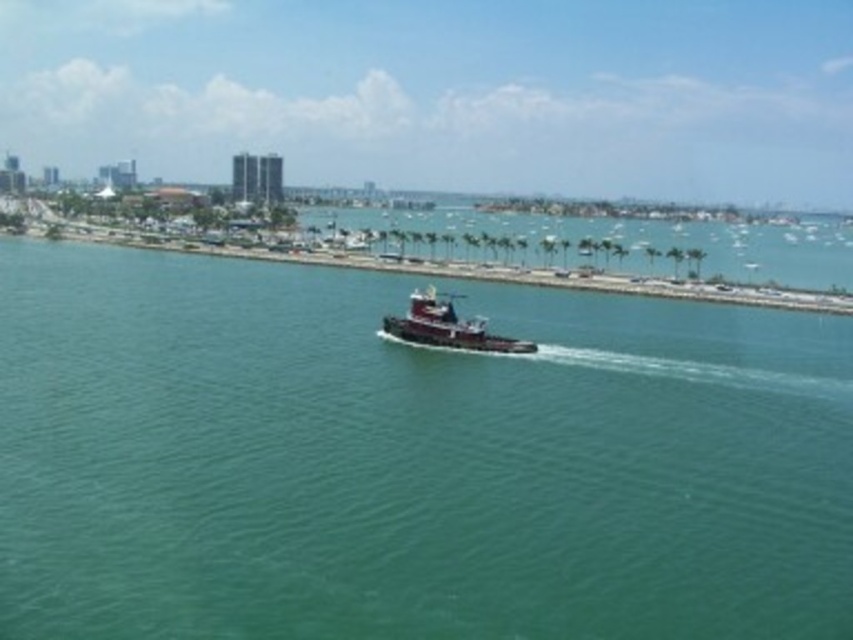
You are a photographer standing on the causeway and want to capture the shiny black tugboat at center and the green water at center in your shot. Which object will appear taller in the photo?

The green water at center appears taller in the photo since it has a greater height compared to the shiny black tugboat at center.

You are a marine biologist observing the coastal scene. You need to determine the spatial relationship between the green water at center and the shiny black tugboat at center. Which object occupies a greater area in the image?

The green water at center has a larger size compared to the shiny black tugboat at center, so it occupies a greater area in the image.